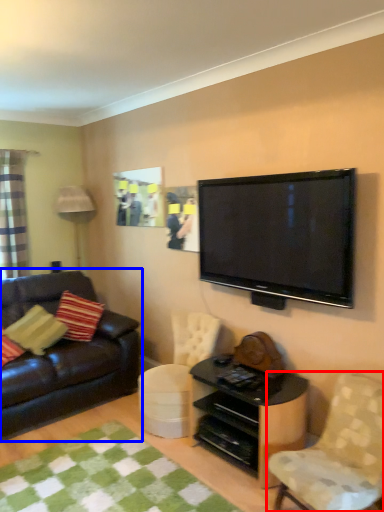
Question: Which object appears closest to the camera in this image, chair (highlighted by a red box) or studio couch (highlighted by a blue box)?

Choices:
 (A) chair
 (B) studio couch

Answer: (A)